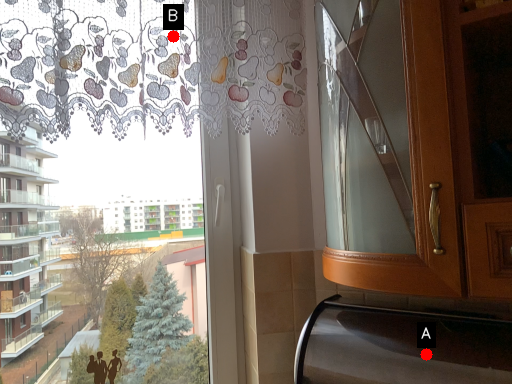
Question: Two points are circled on the image, labeled by A and B beside each circle. Among these points, which one is nearest to the camera?

Choices:
 (A) A is closer
 (B) B is closer

Answer: (A)